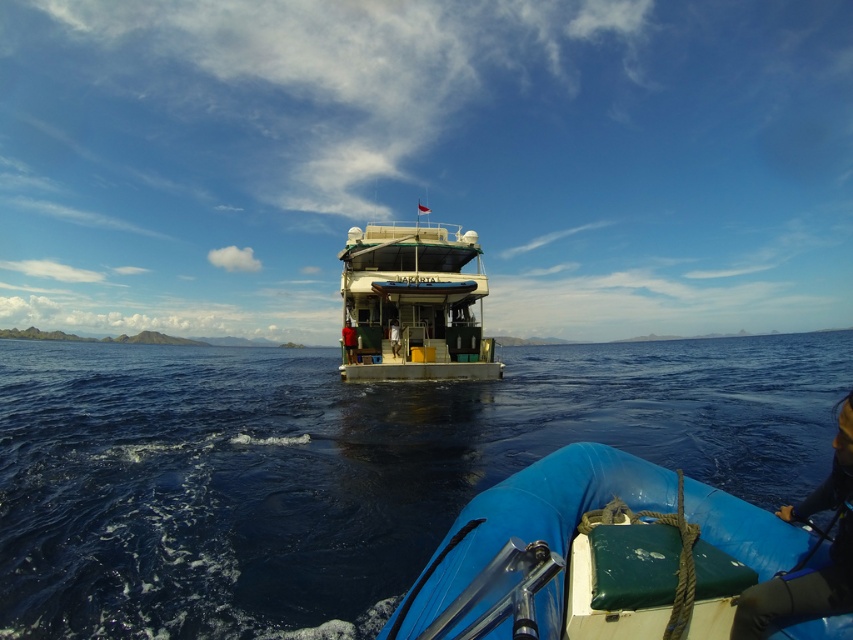
You are on a boat and see the blue rubber boat at lower center and the blue water at center. Which object is located to the left of the other?

The blue water at center is located to the left of the blue rubber boat at lower center.

You are a passenger on the blue rubber boat at lower center and want to board the white glossy boat at center. Considering the width of both boats, which boat will require more space to maneuver around?

The white glossy boat at center has a greater width than the blue rubber boat at lower center, so it will require more space to maneuver around.

You are on the blue water at center and want to reach the white glossy boat at center. Which direction should you move towards?

The blue water at center is to the left of the white glossy boat at center, so you should move towards the right to reach the white glossy boat at center.